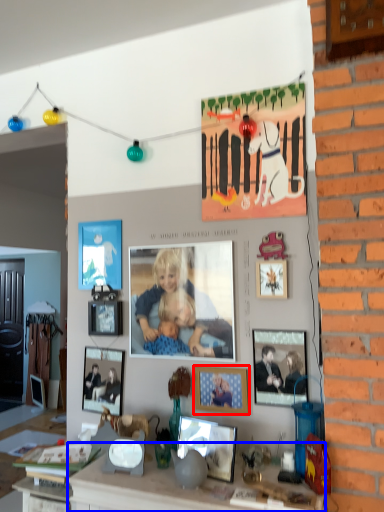
Question: Which object appears farthest to the camera in this image, picture frame (highlighted by a red box) or counter (highlighted by a blue box)?

Choices:
 (A) picture frame
 (B) counter

Answer: (A)